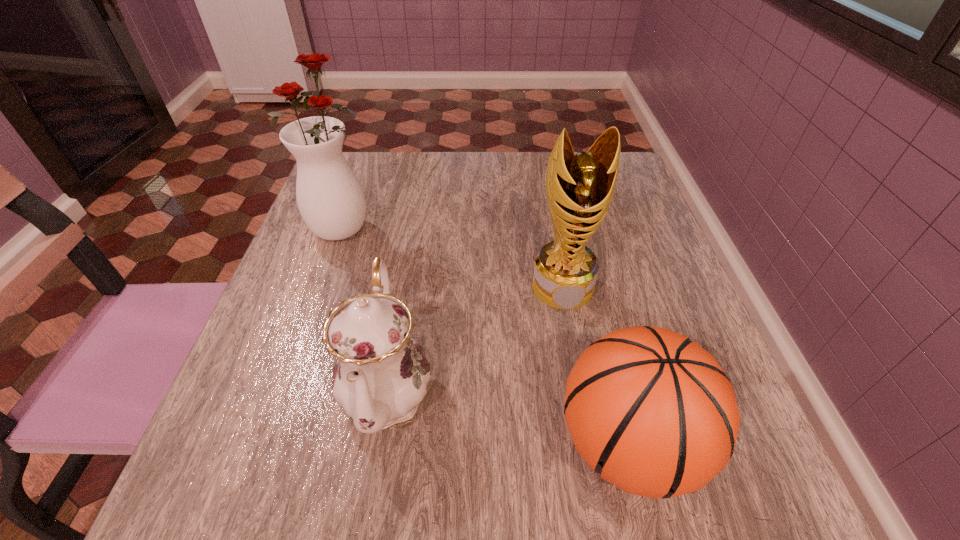
At what (x,y) coordinates should I click in order to perform the action: click on free space at the near right corner of the desktop. Please return your answer as a coordinate pair (x, y). The width and height of the screenshot is (960, 540). Looking at the image, I should click on (755, 484).

Identify the location of unoccupied area between the second farthest object and the second object from left to right. The width and height of the screenshot is (960, 540). (475, 338).

Identify the location of blank region between the chinaware and the award. (475, 338).

I want to click on empty space that is in between the chinaware and the second farthest object, so click(x=475, y=338).

You are a GUI agent. You are given a task and a screenshot of the screen. Output one action in this format:
    pyautogui.click(x=<x>, y=<y>)
    Task: Click on the vacant point located between the basketball and the farthest object
    The image size is (960, 540).
    Given the screenshot: What is the action you would take?
    pyautogui.click(x=484, y=336)

Where is `free area in between the third object from right to left and the basketball`? free area in between the third object from right to left and the basketball is located at coordinates (508, 416).

Image resolution: width=960 pixels, height=540 pixels. What are the coordinates of `free spot between the basketball and the leftmost object` in the screenshot? It's located at tap(484, 336).

Identify the location of free space between the farthest object and the basketball. The image size is (960, 540). (484, 336).

Select which object is the third closest to the vase. Please provide its 2D coordinates. Your answer should be formatted as a tuple, i.e. [(x, y)], where the tuple contains the x and y coordinates of a point satisfying the conditions above.

[(652, 412)]

Choose which object is the second nearest neighbor to the chinaware. Please provide its 2D coordinates. Your answer should be formatted as a tuple, i.e. [(x, y)], where the tuple contains the x and y coordinates of a point satisfying the conditions above.

[(579, 188)]